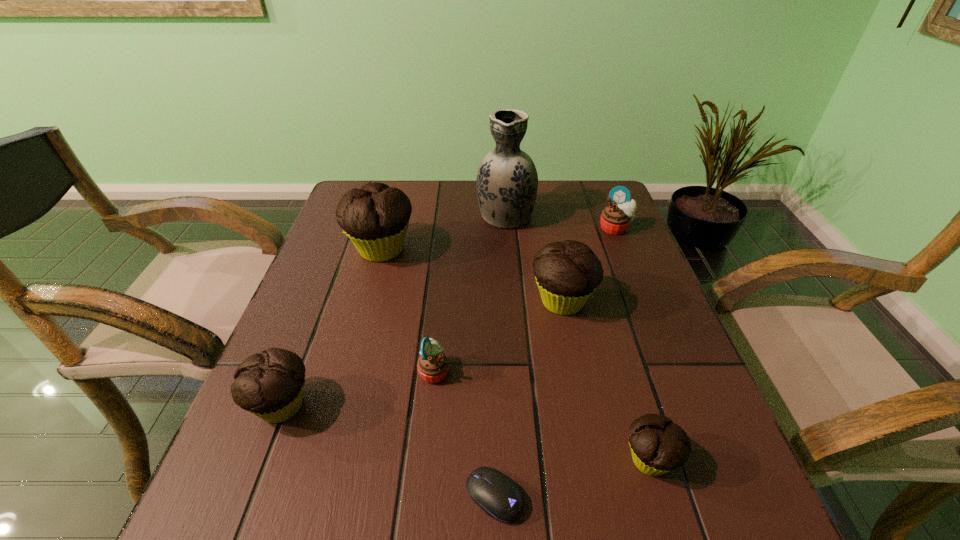
I want to click on free space located 0.340m on the right of the shortest object, so tap(748, 496).

Locate an element on the screen. This screenshot has height=540, width=960. vase at the far edge is located at coordinates (507, 181).

Where is `muffin that is at the far edge`? Image resolution: width=960 pixels, height=540 pixels. muffin that is at the far edge is located at coordinates (615, 219).

The image size is (960, 540). In order to click on object that is at the near edge in this screenshot , I will do `click(496, 494)`.

You are a GUI agent. You are given a task and a screenshot of the screen. Output one action in this format:
    pyautogui.click(x=<x>, y=<y>)
    Task: Click on the object located in the far right corner section of the desktop
    
    Given the screenshot: What is the action you would take?
    pyautogui.click(x=615, y=219)

In the image, there is a desktop. Identify the location of free space at the far edge. (540, 224).

Where is `vacant area at the near edge of the desktop`? The width and height of the screenshot is (960, 540). vacant area at the near edge of the desktop is located at coordinates (347, 497).

In the image, there is a desktop. Identify the location of free space at the right edge. (656, 341).

At what (x,y) coordinates should I click in order to perform the action: click on empty location between the vase and the black computer mouse. Please return your answer as a coordinate pair (x, y). This screenshot has width=960, height=540. Looking at the image, I should click on (500, 355).

This screenshot has height=540, width=960. I want to click on free spot between the second tallest object and the second smallest chocolate muffin, so click(331, 328).